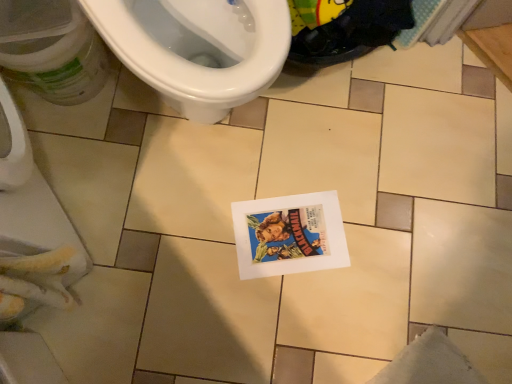
Where is `free point in front of white paper comic book at center`? The image size is (512, 384). free point in front of white paper comic book at center is located at coordinates (276, 321).